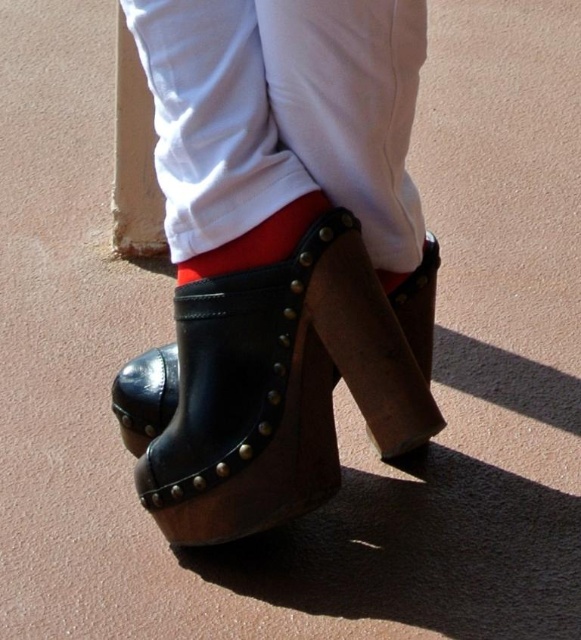
Question: Which point appears closest to the camera in this image?

Choices:
 (A) (174, 413)
 (B) (311, 198)

Answer: (B)

Question: Does black leather sandal at center appear over red leather sock at center?

Choices:
 (A) yes
 (B) no

Answer: (B)

Question: Does black leather sandal at center have a smaller size compared to red leather sock at center?

Choices:
 (A) yes
 (B) no

Answer: (B)

Question: Which point appears closest to the camera in this image?

Choices:
 (A) (261, 257)
 (B) (274, 305)

Answer: (B)

Question: Does black leather sandal at center come behind red leather sock at center?

Choices:
 (A) yes
 (B) no

Answer: (B)

Question: Among these objects, which one is nearest to the camera?

Choices:
 (A) black leather sandal at center
 (B) red leather sock at center

Answer: (A)